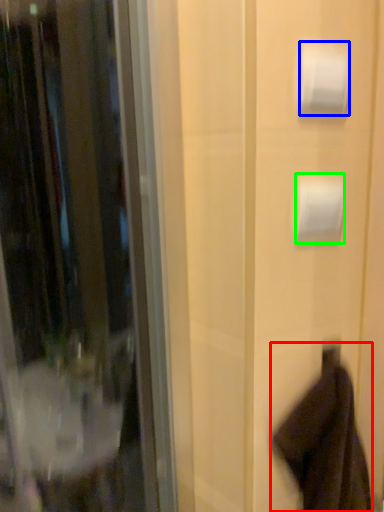
Question: Which object is the closest to the robe (highlighted by a red box)? Choose among these: toilet paper (highlighted by a blue box) or toilet paper (highlighted by a green box).

Choices:
 (A) toilet paper
 (B) toilet paper

Answer: (B)